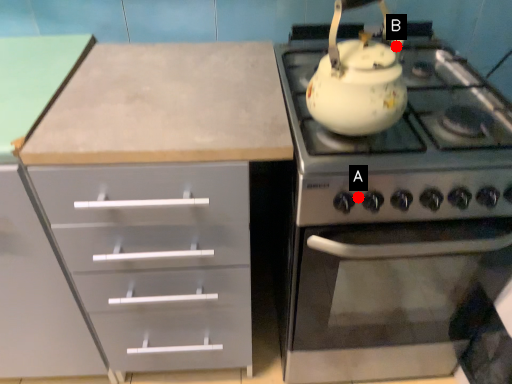
Question: Two points are circled on the image, labeled by A and B beside each circle. Which point is closer to the camera taking this photo?

Choices:
 (A) A is closer
 (B) B is closer

Answer: (A)